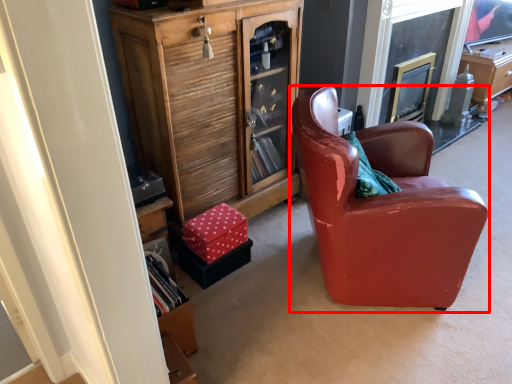
Question: From the image's perspective, where is chair (annotated by the red box) located in relation to cabinetry in the image?

Choices:
 (A) above
 (B) below

Answer: (B)